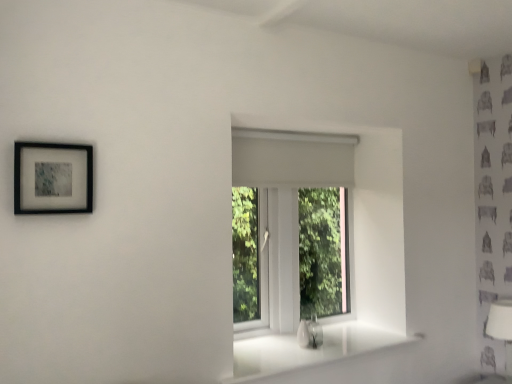
Question: Does white matte window at center have a smaller size compared to black matte picture frame at upper left?

Choices:
 (A) yes
 (B) no

Answer: (B)

Question: From the image's perspective, is white matte window at center below black matte picture frame at upper left?

Choices:
 (A) yes
 (B) no

Answer: (A)

Question: Is the depth of white matte window at center greater than that of black matte picture frame at upper left?

Choices:
 (A) no
 (B) yes

Answer: (B)

Question: Considering the relative positions of white matte window at center and black matte picture frame at upper left in the image provided, is white matte window at center to the left of black matte picture frame at upper left from the viewer's perspective?

Choices:
 (A) no
 (B) yes

Answer: (A)

Question: From a real-world perspective, is white matte window at center positioned over black matte picture frame at upper left based on gravity?

Choices:
 (A) yes
 (B) no

Answer: (B)

Question: In terms of height, does white glossy sink at lower center look taller or shorter compared to white fabric lampshade at lower right?

Choices:
 (A) short
 (B) tall

Answer: (A)

Question: Is white glossy sink at lower center bigger or smaller than white fabric lampshade at lower right?

Choices:
 (A) big
 (B) small

Answer: (B)

Question: From a real-world perspective, is white glossy sink at lower center above or below white fabric lampshade at lower right?

Choices:
 (A) below
 (B) above

Answer: (B)

Question: Is white glossy sink at lower center wider or thinner than white fabric lampshade at lower right?

Choices:
 (A) thin
 (B) wide

Answer: (A)

Question: In terms of height, does white fabric lampshade at lower right look taller or shorter compared to white matte window at center?

Choices:
 (A) tall
 (B) short

Answer: (B)

Question: From the image's perspective, relative to white matte window at center, is white fabric lampshade at lower right above or below?

Choices:
 (A) below
 (B) above

Answer: (A)

Question: From a real-world perspective, is white fabric lampshade at lower right positioned above or below white matte window at center?

Choices:
 (A) above
 (B) below

Answer: (B)

Question: In terms of size, does white fabric lampshade at lower right appear bigger or smaller than white matte window at center?

Choices:
 (A) small
 (B) big

Answer: (A)

Question: In terms of width, does white glossy sink at lower center look wider or thinner when compared to black matte picture frame at upper left?

Choices:
 (A) wide
 (B) thin

Answer: (A)

Question: Is point (305, 334) positioned closer to the camera than point (23, 195)?

Choices:
 (A) closer
 (B) farther

Answer: (B)